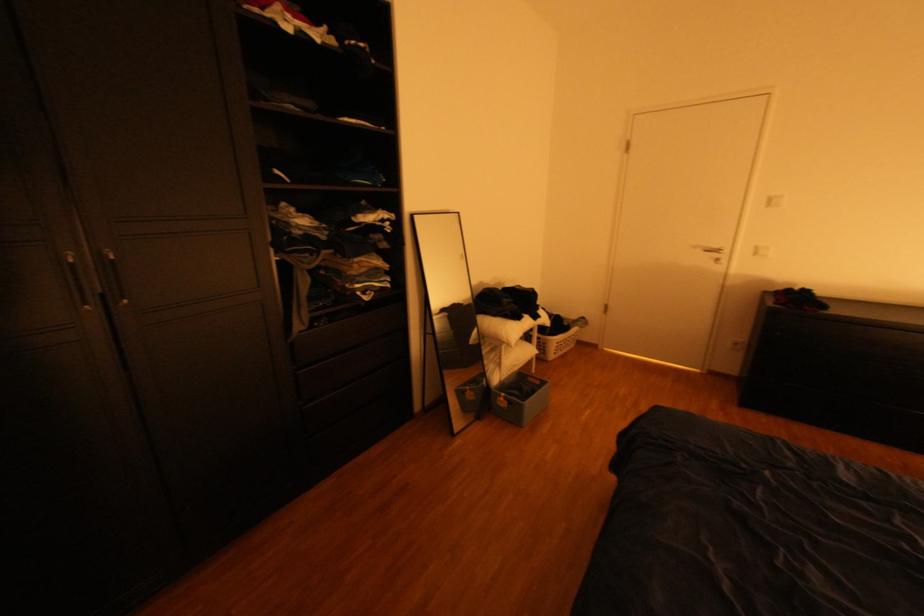
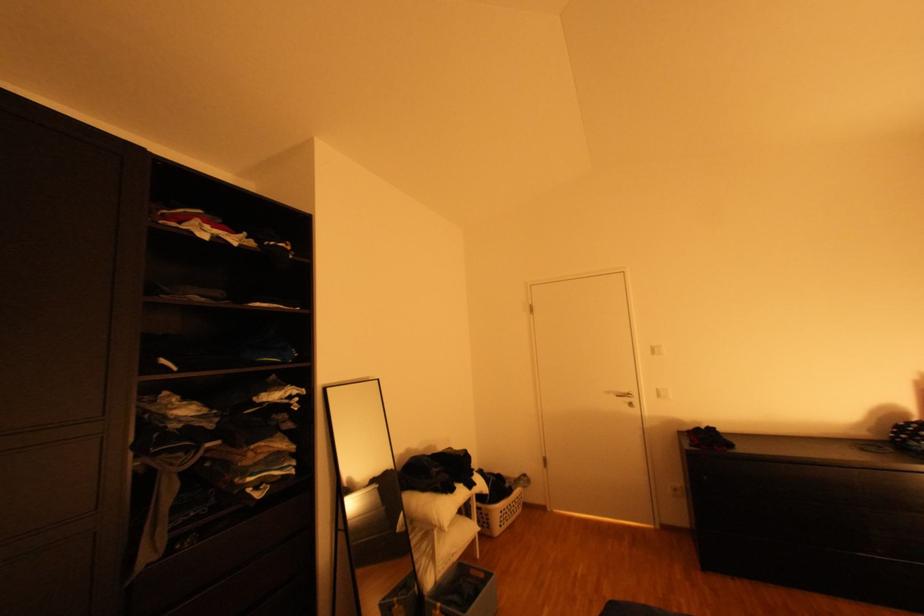
Find the pixel in the second image that matches the point at 513,339 in the first image.

(444, 523)